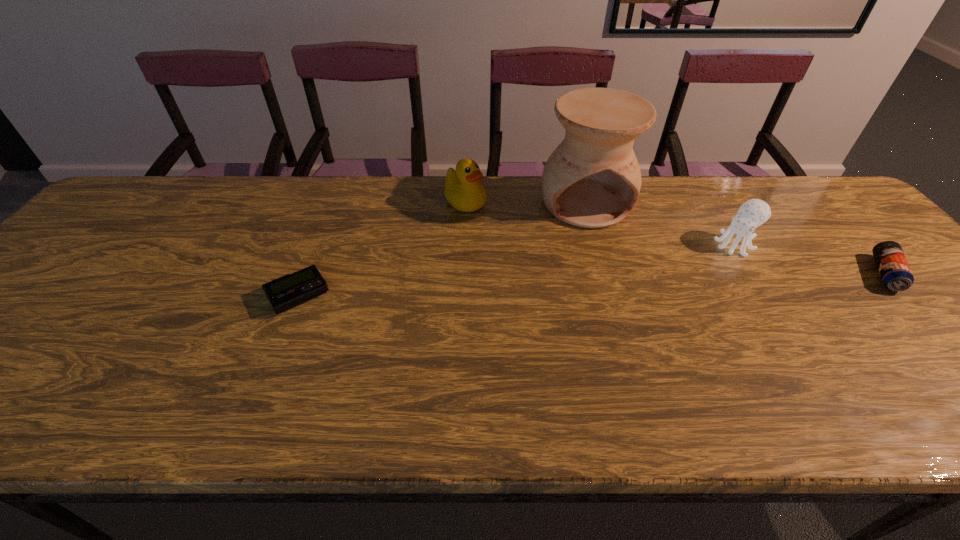
Identify the location of vacant space located at the open side of the tallest object. The height and width of the screenshot is (540, 960). (642, 334).

Locate an element on the screen. This screenshot has height=540, width=960. duck at the far edge is located at coordinates (462, 190).

You are a GUI agent. You are given a task and a screenshot of the screen. Output one action in this format:
    pyautogui.click(x=<x>, y=<y>)
    Task: Click on the pottery present at the far edge
    The height and width of the screenshot is (540, 960).
    Given the screenshot: What is the action you would take?
    pyautogui.click(x=592, y=179)

The image size is (960, 540). Find the location of `object that is at the right edge`. object that is at the right edge is located at coordinates (896, 275).

You are a GUI agent. You are given a task and a screenshot of the screen. Output one action in this format:
    pyautogui.click(x=<x>, y=<y>)
    Task: Click on the vacant space at the far edge of the desktop
    This screenshot has width=960, height=540.
    Given the screenshot: What is the action you would take?
    pyautogui.click(x=696, y=183)

Identify the location of vacant space at the near edge of the desktop. Image resolution: width=960 pixels, height=540 pixels. (594, 380).

Find the location of a particular element. vacant region at the left edge is located at coordinates (61, 318).

At what (x,y) coordinates should I click in order to perform the action: click on blank space at the right edge of the desktop. Please return your answer as a coordinate pair (x, y). The image size is (960, 540). Looking at the image, I should click on (949, 340).

In the image, there is a desktop. Where is `vacant space at the far left corner`? Image resolution: width=960 pixels, height=540 pixels. vacant space at the far left corner is located at coordinates (147, 209).

The height and width of the screenshot is (540, 960). I want to click on free space at the far right corner of the desktop, so click(x=776, y=176).